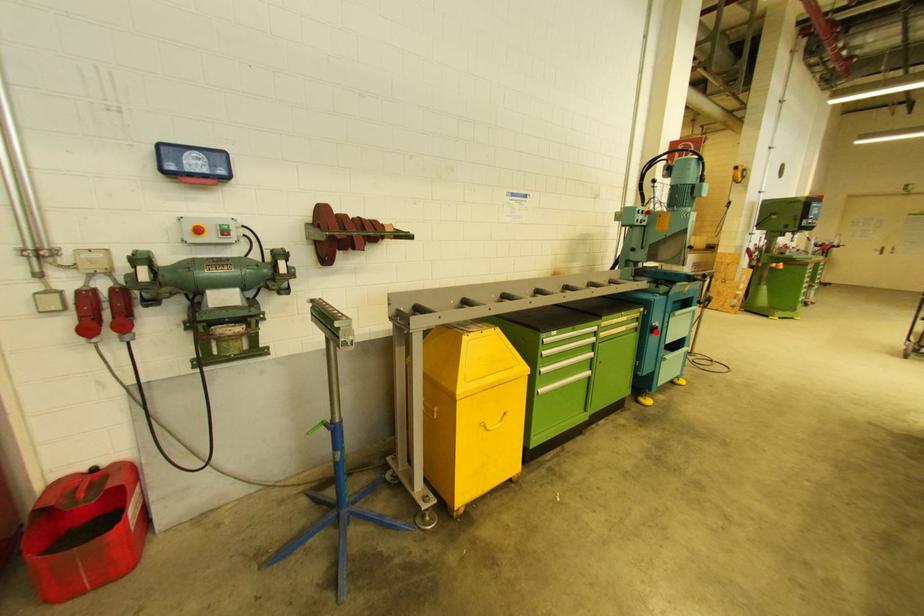
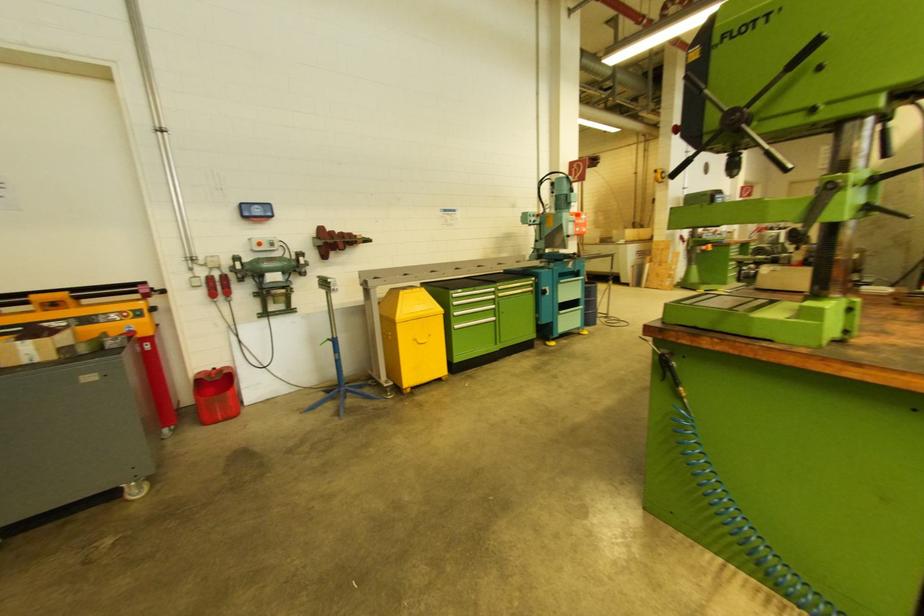
Question: I am providing you with two images of the same scene from different viewpoints. Image1 has a red point marked. In image2, the corresponding 3D location appears at what relative position? Reply with the corresponding letter.

Choices:
 (A) Closer
 (B) Farther

Answer: (A)